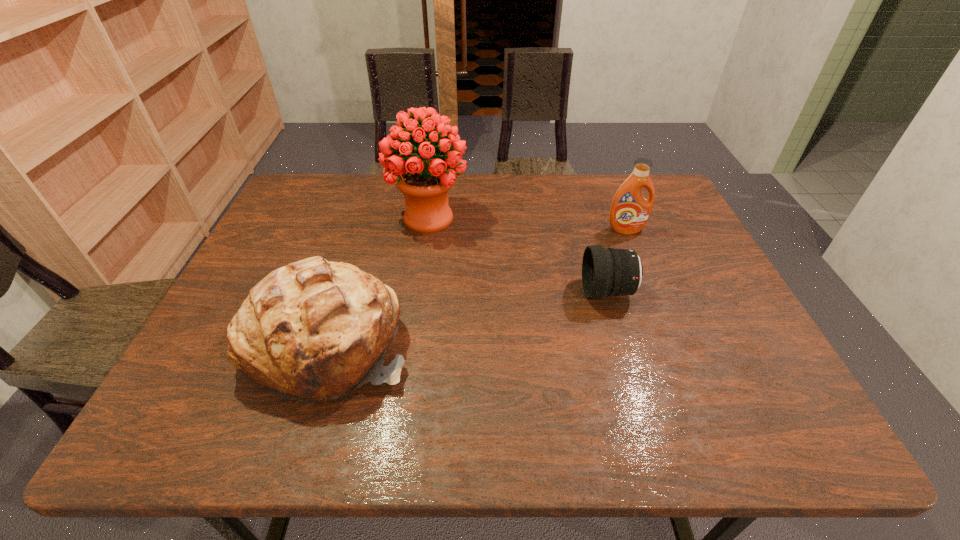
Find the location of a particular element. free space that is in between the telephoto lens and the bread is located at coordinates (468, 318).

This screenshot has width=960, height=540. Identify the location of vacant space that is in between the tallest object and the shortest object. (518, 255).

Identify the location of free space between the bread and the detergent. The image size is (960, 540). (477, 286).

I want to click on vacant space that is in between the bread and the shortest object, so click(x=468, y=318).

Identify the location of vacant area that lies between the bread and the detergent. This screenshot has height=540, width=960. (477, 286).

Locate an element on the screen. This screenshot has width=960, height=540. object that stands as the closest to the detergent is located at coordinates (605, 271).

The height and width of the screenshot is (540, 960). Identify the location of object that stands as the second closest to the detergent. (424, 183).

Find the location of `free space in the image that satisfies the following two spatial constraints: 1. at the front element of the telephoto lens; 2. on the front side of the bread`. free space in the image that satisfies the following two spatial constraints: 1. at the front element of the telephoto lens; 2. on the front side of the bread is located at coordinates (623, 343).

Find the location of a particular element. This screenshot has width=960, height=540. vacant space that satisfies the following two spatial constraints: 1. on the front-facing side of the detergent; 2. at the front element of the telephoto lens is located at coordinates (651, 292).

Where is `free space that satisfies the following two spatial constraints: 1. on the front-facing side of the detergent; 2. at the front element of the shortest object`? Image resolution: width=960 pixels, height=540 pixels. free space that satisfies the following two spatial constraints: 1. on the front-facing side of the detergent; 2. at the front element of the shortest object is located at coordinates (651, 292).